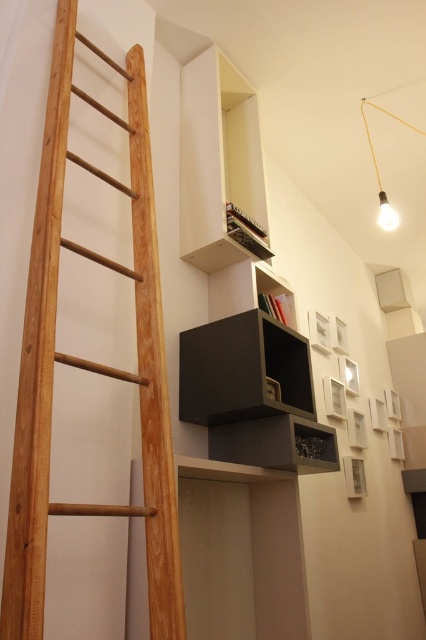
You are standing in the room and want to reach a book on the topmost shelf. The natural wood ladder at left is 32.66 inches from you. Can you use the ladder to reach the book?

The natural wood ladder at left is 32.66 inches from the viewer, so you can use it to reach the book on the topmost shelf since the distance is manageable.

You are standing in the center of the room and want to reach the topmost shelf on the right wall. Which direction should you move relative to the natural wood ladder at left to get closer to the shelf?

To reach the topmost shelf on the right wall, you should move to the right of the natural wood ladder at left since the ladder is positioned on the left side of the room and the shelves are to the right of it.

You are moving a potted plant from the entrance to the area near the natural wood ladder at left and the matte black shelf at center. Which object will the plant be closer to after moving it to the area between them?

The potted plant will be closer to the natural wood ladder at left because it is positioned in front of the matte black shelf at center, meaning the ladder is nearer to the plant than the shelf.